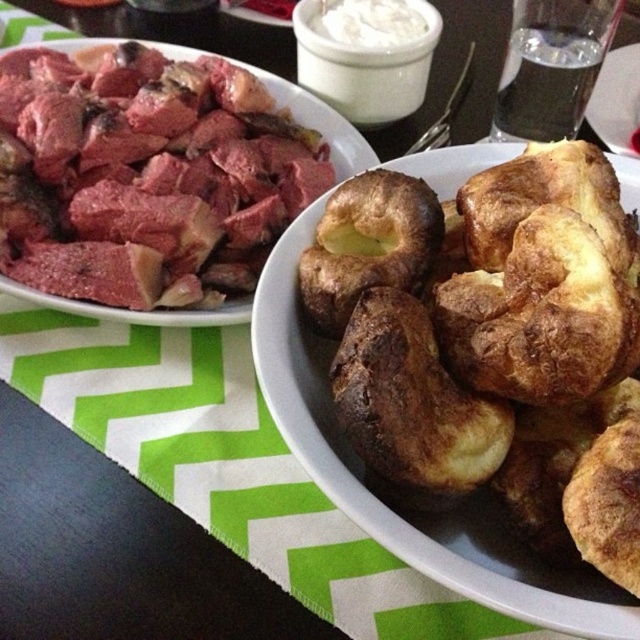
Question: Is golden brown crusty yorkshire pudding at center to the right of pinkish matte meat at upper left from the viewer's perspective?

Choices:
 (A) yes
 (B) no

Answer: (A)

Question: Is the position of golden brown crusty yorkshire pudding at center less distant than that of pinkish matte meat at upper left?

Choices:
 (A) no
 (B) yes

Answer: (B)

Question: Which point is closer to the camera?

Choices:
 (A) (557, 296)
 (B) (317, 124)

Answer: (A)

Question: In this image, where is golden brown crusty yorkshire pudding at center located relative to pinkish matte meat at upper left?

Choices:
 (A) left
 (B) right

Answer: (B)